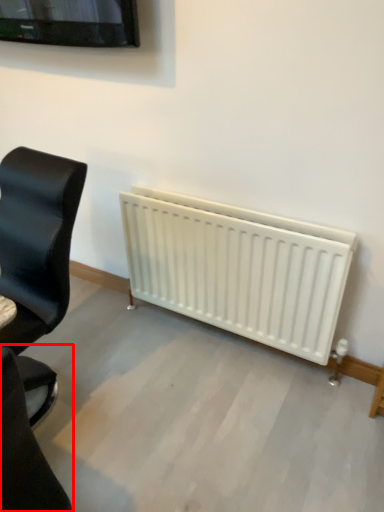
Question: In this image, where is chair (annotated by the red box) located relative to chair?

Choices:
 (A) right
 (B) left

Answer: (A)